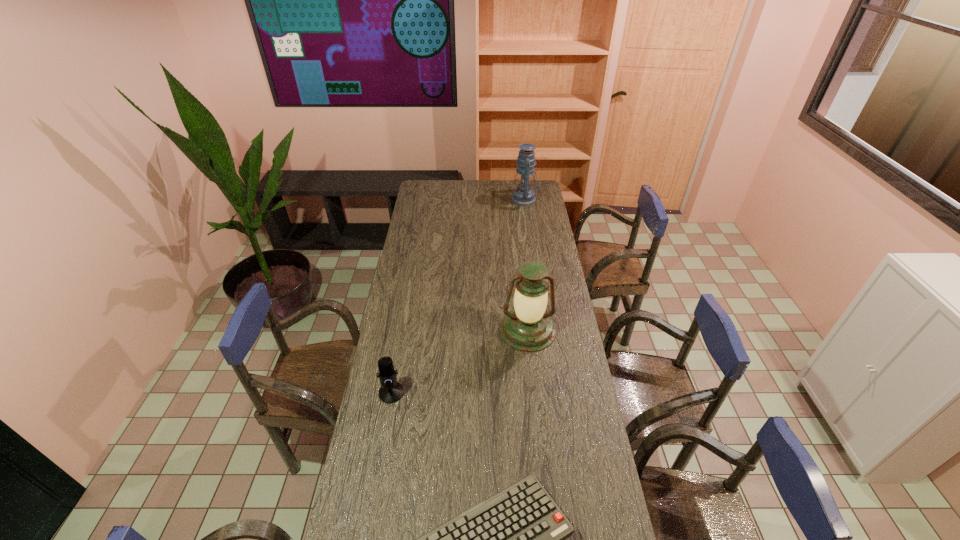
Identify the location of object that is at the left edge. The width and height of the screenshot is (960, 540). (391, 391).

The height and width of the screenshot is (540, 960). I want to click on object at the far right corner, so click(523, 195).

Locate an element on the screen. blank space at the far edge is located at coordinates pyautogui.click(x=493, y=192).

In the image, there is a desktop. Where is `vacant space at the left edge`? This screenshot has width=960, height=540. vacant space at the left edge is located at coordinates (433, 205).

Identify the location of free spot at the right edge of the desktop. (535, 222).

You are a GUI agent. You are given a task and a screenshot of the screen. Output one action in this format:
    pyautogui.click(x=<x>, y=<y>)
    Task: Click on the vacant space at the far left corner
    Image resolution: width=960 pixels, height=540 pixels.
    Given the screenshot: What is the action you would take?
    pyautogui.click(x=431, y=187)

Find the location of `empty location between the third nearest object and the microphone`. empty location between the third nearest object and the microphone is located at coordinates (460, 361).

In order to click on vacant area that lies between the microphone and the farthest object in this screenshot , I will do `click(458, 296)`.

Find the location of a particular element. vacant region between the third nearest object and the third farthest object is located at coordinates (460, 361).

I want to click on unoccupied area between the third nearest object and the microphone, so click(x=460, y=361).